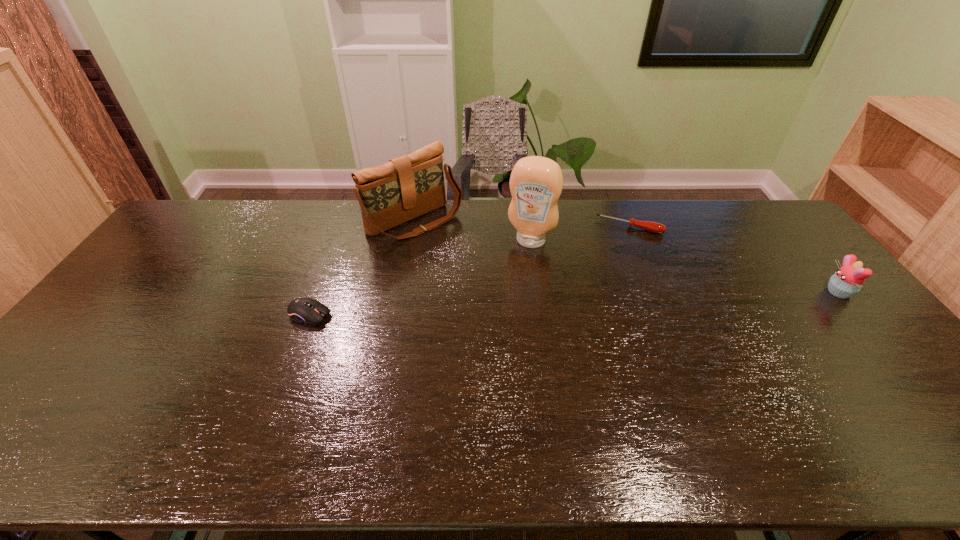
Identify the location of free space located on the label of the tallest object. (506, 300).

Where is `free spot located 0.080m on the label of the tallest object`? free spot located 0.080m on the label of the tallest object is located at coordinates (519, 266).

What are the coordinates of `blank space located on the label of the tallest object` in the screenshot? It's located at (506, 300).

Identify the location of shoulder bag at the far edge. The width and height of the screenshot is (960, 540). (406, 187).

At what (x,y) coordinates should I click in order to perform the action: click on screwdriver located in the far edge section of the desktop. Please return your answer as a coordinate pair (x, y). This screenshot has width=960, height=540. Looking at the image, I should click on (654, 227).

You are a GUI agent. You are given a task and a screenshot of the screen. Output one action in this format:
    pyautogui.click(x=<x>, y=<y>)
    Task: Click on the condiment present at the far edge
    This screenshot has height=540, width=960.
    Given the screenshot: What is the action you would take?
    pyautogui.click(x=536, y=182)

This screenshot has width=960, height=540. Find the location of `object that is at the right edge`. object that is at the right edge is located at coordinates (847, 281).

Where is `free spot at the far edge of the desktop`? The width and height of the screenshot is (960, 540). free spot at the far edge of the desktop is located at coordinates (591, 227).

This screenshot has width=960, height=540. In the image, there is a desktop. Find the location of `vacant area at the near edge`. vacant area at the near edge is located at coordinates pyautogui.click(x=305, y=400).

Find the location of `free space at the left edge of the desktop`. free space at the left edge of the desktop is located at coordinates (121, 296).